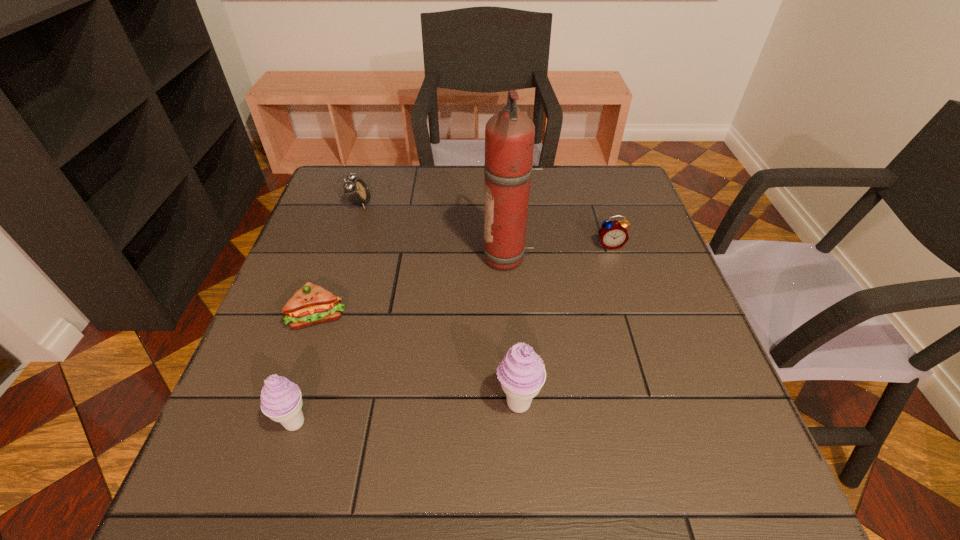
Locate an element on the screen. alarm clock that is at the left edge is located at coordinates (357, 192).

This screenshot has width=960, height=540. Identify the location of sandwich present at the left edge. (312, 304).

The width and height of the screenshot is (960, 540). I want to click on object present at the right edge, so click(613, 234).

Image resolution: width=960 pixels, height=540 pixels. In order to click on object that is at the far left corner in this screenshot , I will do `click(357, 192)`.

Where is `object positioned at the near left corner`? object positioned at the near left corner is located at coordinates (281, 400).

This screenshot has height=540, width=960. I want to click on vacant region at the far edge of the desktop, so click(x=463, y=168).

Image resolution: width=960 pixels, height=540 pixels. In the image, there is a desktop. What are the coordinates of `vacant space at the near edge` in the screenshot? It's located at tap(505, 437).

Find the location of a particular element. vacant space at the left edge of the desktop is located at coordinates (359, 239).

In the image, there is a desktop. Find the location of `free space at the right edge`. free space at the right edge is located at coordinates (676, 364).

This screenshot has width=960, height=540. In the image, there is a desktop. What are the coordinates of `free space at the far left corner` in the screenshot? It's located at (333, 188).